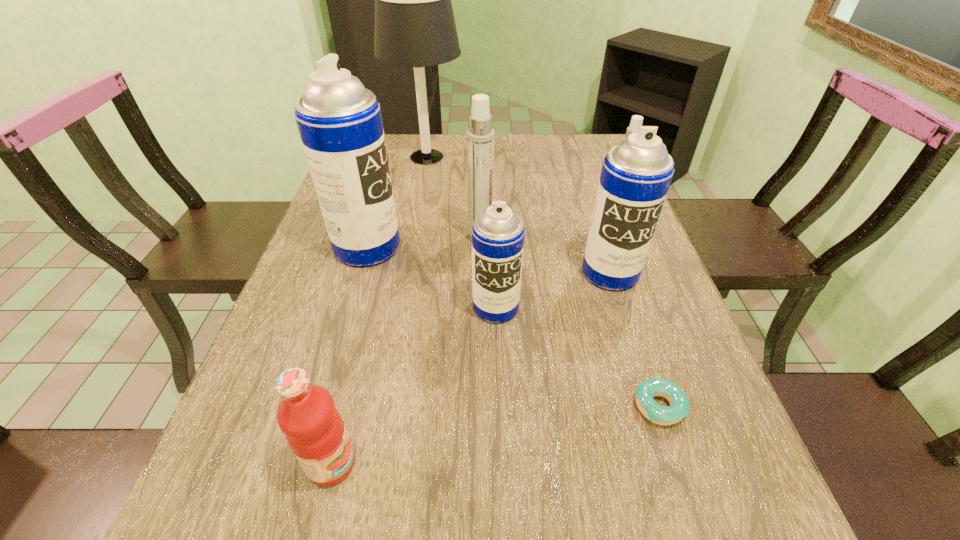
In order to click on vacant region located 0.130m on the front of the shortest object in this screenshot , I will do `click(694, 511)`.

Locate an element on the screen. This screenshot has height=540, width=960. object that is at the far edge is located at coordinates (x=415, y=27).

Find the location of a particular element. This screenshot has height=540, width=960. table lamp at the left edge is located at coordinates (415, 27).

Where is `aerosol can located at the left edge`? aerosol can located at the left edge is located at coordinates (339, 121).

This screenshot has width=960, height=540. I want to click on fruit juice that is at the left edge, so click(315, 431).

Find the location of `doughnut that is at the right edge`. doughnut that is at the right edge is located at coordinates (679, 408).

What are the coordinates of `object that is at the far left corner` in the screenshot? It's located at (415, 27).

This screenshot has height=540, width=960. What are the coordinates of `vacant region at the far edge of the desktop` in the screenshot? It's located at (534, 148).

I want to click on vacant space at the left edge of the desktop, so click(317, 354).

Locate an element on the screen. vacant space at the right edge is located at coordinates (706, 379).